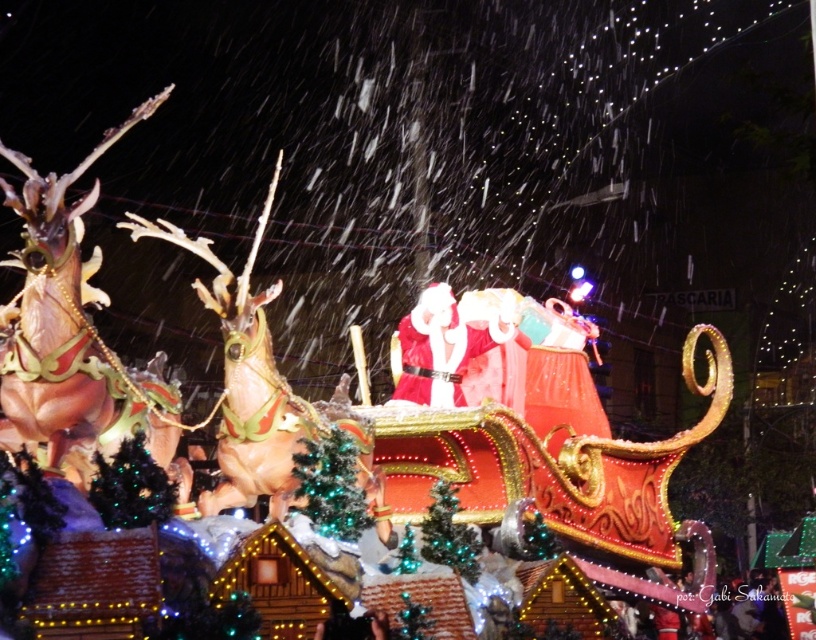
Does point (86, 288) lie in front of point (291, 468)?

No, (86, 288) is further to viewer.

Who is more distant from viewer, (x=73, y=214) or (x=366, y=509)?

Point (x=366, y=509)

Measure the distance between shiny gold antlers at left and camera.

shiny gold antlers at left is 238.43 feet away from camera.

This screenshot has width=816, height=640. I want to click on shiny gold antlers at left, so click(x=64, y=332).

Between shiny gold antlers at left and green beaded garland at center, which one is positioned lower?

green beaded garland at center is below.

Is shiny gold antlers at left shorter than green beaded garland at center?

No, shiny gold antlers at left is not shorter than green beaded garland at center.

Who is more distant from viewer, (38, 333) or (460, 554)?

Positioned behind is point (460, 554).

What are the coordinates of `shiny gold antlers at left` in the screenshot? It's located at (64, 332).

Does velvet red santa at center have a greater width compared to green glittering christmas tree at center?

Correct, the width of velvet red santa at center exceeds that of green glittering christmas tree at center.

Is point (457, 328) more distant than point (308, 444)?

Yes, point (457, 328) is farther from viewer.

The height and width of the screenshot is (640, 816). In order to click on velvet red santa at center in this screenshot , I will do `click(442, 346)`.